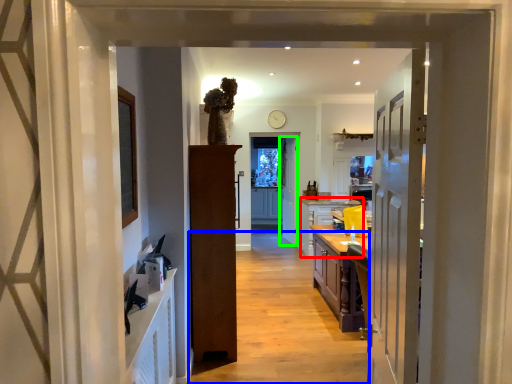
Question: Estimate the real-world distances between objects in this image. Which object is closer to cabinetry (highlighted by a red box), path (highlighted by a blue box) or door (highlighted by a green box)?

Choices:
 (A) path
 (B) door

Answer: (B)